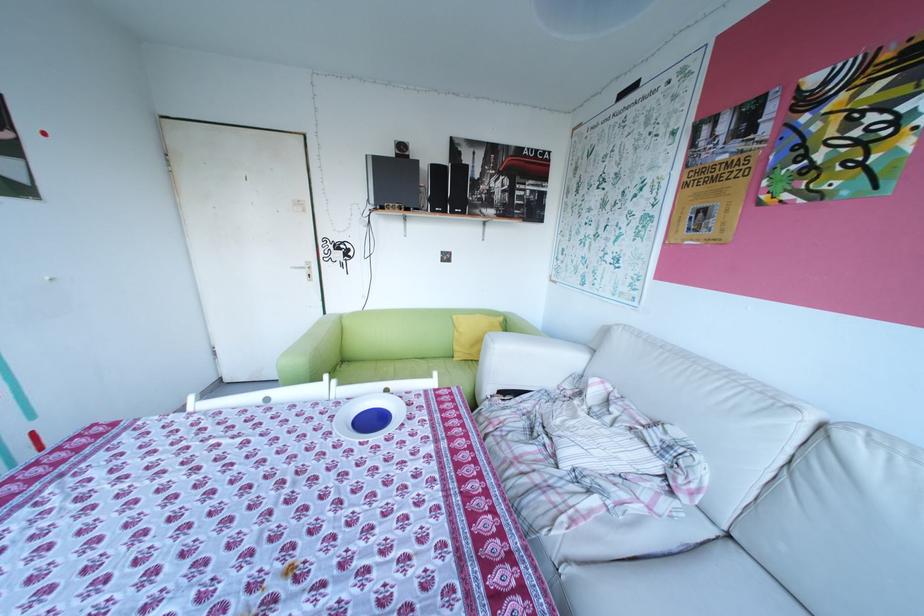
Describe the element at coordinates (679, 585) in the screenshot. This screenshot has height=616, width=924. I see `a white sofa sitting surface` at that location.